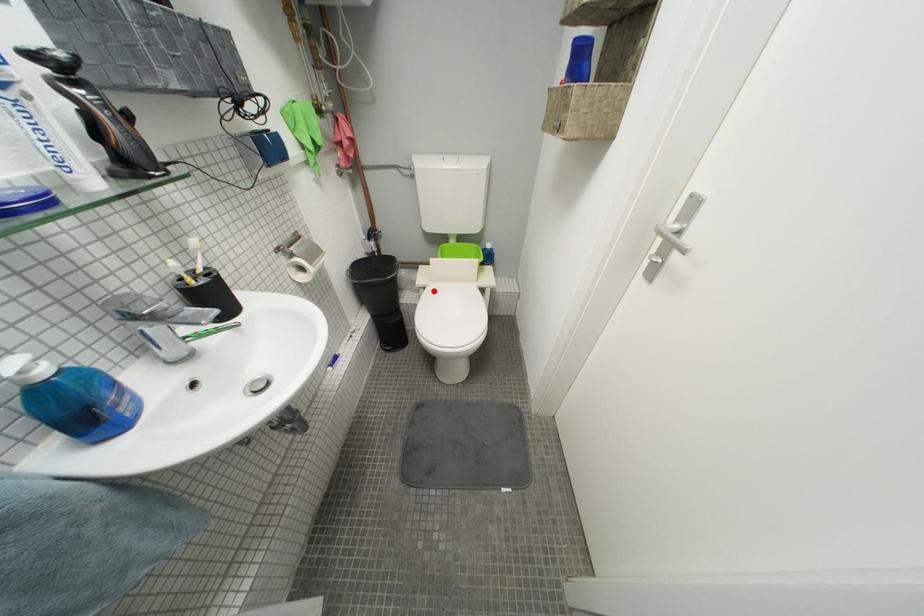
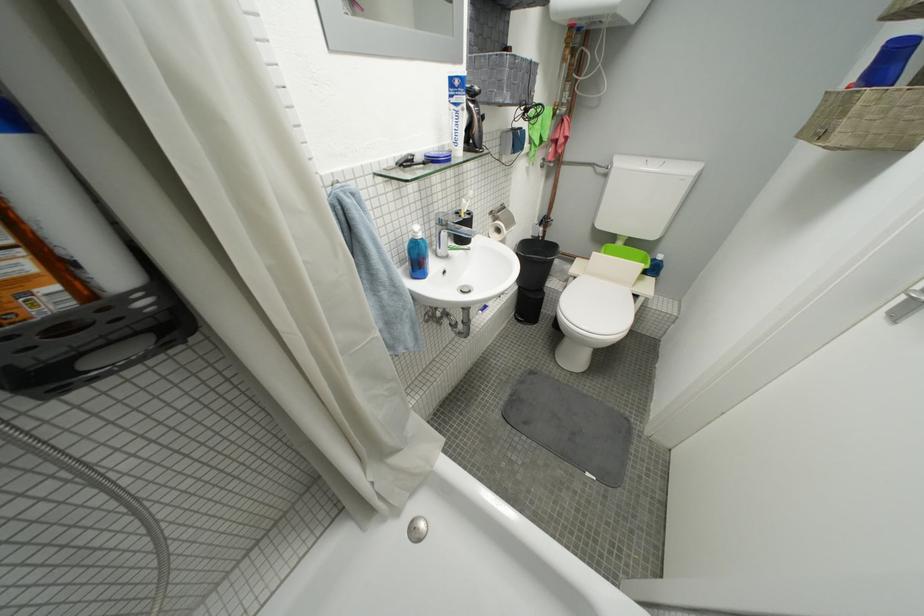
Question: I am providing you with two images of the same scene from different viewpoints. A red point is shown in image1. For the corresponding object point in image2, is it positioned nearer or farther from the camera?

Choices:
 (A) Nearer
 (B) Farther

Answer: (A)